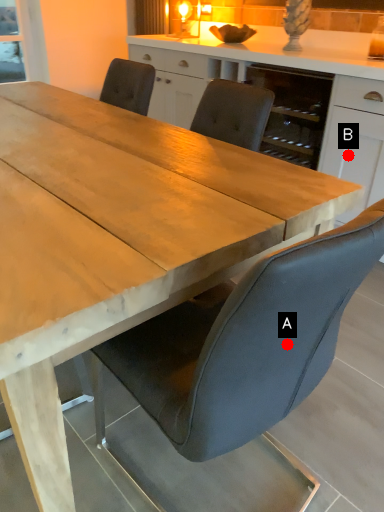
Question: Two points are circled on the image, labeled by A and B beside each circle. Which point is farther to the camera?

Choices:
 (A) A is further
 (B) B is further

Answer: (B)